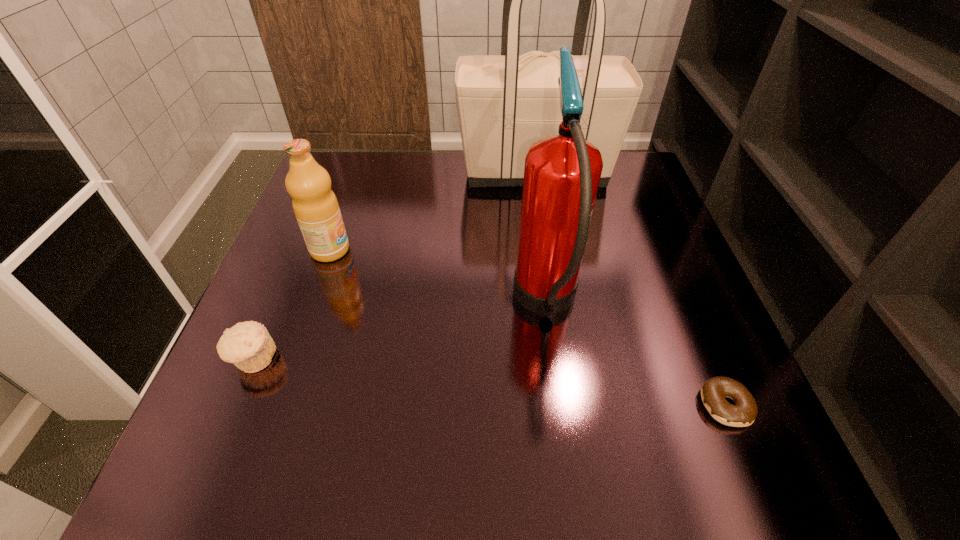
Where is `unoccupied area between the fruit juice and the shortest object`? The width and height of the screenshot is (960, 540). unoccupied area between the fruit juice and the shortest object is located at coordinates (528, 327).

This screenshot has height=540, width=960. I want to click on unoccupied position between the fourth tallest object and the shopping bag, so click(x=395, y=265).

The height and width of the screenshot is (540, 960). I want to click on vacant area that lies between the nearest object and the fourth tallest object, so click(490, 382).

Where is `vacant area that lies between the second shortest object and the fourth shortest object`? This screenshot has width=960, height=540. vacant area that lies between the second shortest object and the fourth shortest object is located at coordinates coord(400,332).

I want to click on vacant area that lies between the third tallest object and the shopping bag, so click(433, 211).

Choose which object is the nearest neighbor to the fruit juice. Please provide its 2D coordinates. Your answer should be formatted as a tuple, i.e. [(x, y)], where the tuple contains the x and y coordinates of a point satisfying the conditions above.

[(248, 345)]

Image resolution: width=960 pixels, height=540 pixels. What are the coordinates of `object that is the closest to the shortest object` in the screenshot? It's located at (562, 172).

The height and width of the screenshot is (540, 960). Find the location of `free location that satisfies the following two spatial constraints: 1. with handles facing forward on the farthest object; 2. on the front side of the muffin`. free location that satisfies the following two spatial constraints: 1. with handles facing forward on the farthest object; 2. on the front side of the muffin is located at coordinates (565, 359).

Where is `blank space that satisfies the following two spatial constraints: 1. with handles facing forward on the nearest object; 2. on the right side of the farthest object`? This screenshot has width=960, height=540. blank space that satisfies the following two spatial constraints: 1. with handles facing forward on the nearest object; 2. on the right side of the farthest object is located at coordinates (572, 405).

The height and width of the screenshot is (540, 960). I want to click on blank area in the image that satisfies the following two spatial constraints: 1. on the front side of the muffin; 2. on the left side of the doughnut, so click(235, 405).